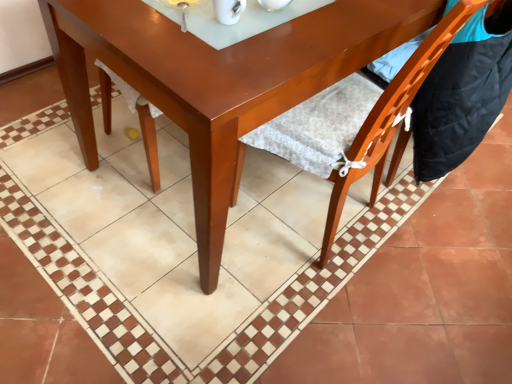
Question: Is glossy wood table at center wider than orange wood chair at lower right, which is the first chair from right to left?

Choices:
 (A) no
 (B) yes

Answer: (B)

Question: From the image's perspective, is glossy wood table at center under orange wood chair at lower right, which is the first chair from right to left?

Choices:
 (A) yes
 (B) no

Answer: (B)

Question: Considering the relative sizes of glossy wood table at center and orange wood chair at lower right, the second chair positioned from the left, in the image provided, is glossy wood table at center smaller than orange wood chair at lower right, the second chair positioned from the left,?

Choices:
 (A) yes
 (B) no

Answer: (B)

Question: Does glossy wood table at center appear on the right side of orange wood chair at lower right, the second chair positioned from the left?

Choices:
 (A) no
 (B) yes

Answer: (A)

Question: Would you say orange wood chair at lower right, the second chair positioned from the left, is part of glossy wood table at center's contents?

Choices:
 (A) no
 (B) yes

Answer: (A)

Question: In terms of height, does orange wood chair at lower right, the second chair positioned from the left, look taller or shorter compared to wooden chair at lower right, arranged as the first chair when viewed from the left?

Choices:
 (A) tall
 (B) short

Answer: (B)

Question: Considering the positions of orange wood chair at lower right, the second chair positioned from the left, and wooden chair at lower right, arranged as the first chair when viewed from the left, in the image, is orange wood chair at lower right, the second chair positioned from the left, wider or thinner than wooden chair at lower right, arranged as the first chair when viewed from the left,?

Choices:
 (A) wide
 (B) thin

Answer: (B)

Question: Considering the relative positions of orange wood chair at lower right, the second chair positioned from the left, and wooden chair at lower right, arranged as the first chair when viewed from the left, in the image provided, is orange wood chair at lower right, the second chair positioned from the left, to the left or to the right of wooden chair at lower right, arranged as the first chair when viewed from the left,?

Choices:
 (A) left
 (B) right

Answer: (B)

Question: From the image's perspective, relative to wooden chair at lower right, positioned as the second chair in right-to-left order, is orange wood chair at lower right, the second chair positioned from the left, above or below?

Choices:
 (A) above
 (B) below

Answer: (A)

Question: In terms of height, does glossy wood table at center look taller or shorter compared to wooden chair at lower right, arranged as the first chair when viewed from the left?

Choices:
 (A) short
 (B) tall

Answer: (A)

Question: In terms of size, does glossy wood table at center appear bigger or smaller than wooden chair at lower right, arranged as the first chair when viewed from the left?

Choices:
 (A) big
 (B) small

Answer: (A)

Question: From a real-world perspective, is glossy wood table at center positioned above or below wooden chair at lower right, arranged as the first chair when viewed from the left?

Choices:
 (A) above
 (B) below

Answer: (B)

Question: From the image's perspective, is glossy wood table at center located above or below wooden chair at lower right, arranged as the first chair when viewed from the left?

Choices:
 (A) below
 (B) above

Answer: (B)

Question: From the image's perspective, relative to glossy wood table at center, is wooden chair at lower right, arranged as the first chair when viewed from the left, above or below?

Choices:
 (A) above
 (B) below

Answer: (B)

Question: Is wooden chair at lower right, positioned as the second chair in right-to-left order, in front of or behind glossy wood table at center in the image?

Choices:
 (A) behind
 (B) front

Answer: (B)